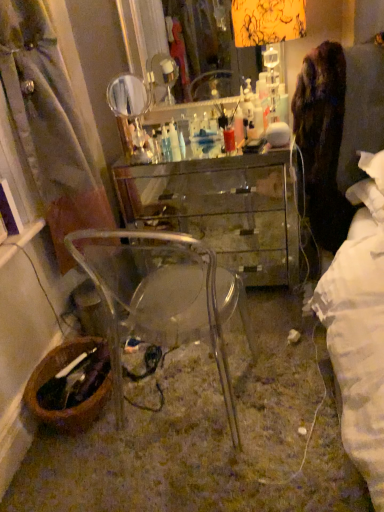
Question: Can you confirm if brown woven picnic basket at lower left is wider than transparent glass desk at center?

Choices:
 (A) yes
 (B) no

Answer: (B)

Question: Is brown woven picnic basket at lower left taller than transparent glass desk at center?

Choices:
 (A) no
 (B) yes

Answer: (A)

Question: Does brown woven picnic basket at lower left have a larger size compared to transparent glass desk at center?

Choices:
 (A) yes
 (B) no

Answer: (B)

Question: From the image's perspective, is brown woven picnic basket at lower left below transparent glass desk at center?

Choices:
 (A) yes
 (B) no

Answer: (A)

Question: Considering the relative positions of brown woven picnic basket at lower left and transparent glass desk at center in the image provided, is brown woven picnic basket at lower left in front of transparent glass desk at center?

Choices:
 (A) yes
 (B) no

Answer: (A)

Question: Would you say transparent glass desk at center is part of brown woven picnic basket at lower left's contents?

Choices:
 (A) yes
 (B) no

Answer: (B)

Question: Does transparent glass desk at center appear on the right side of transparent plastic chair at lower center?

Choices:
 (A) no
 (B) yes

Answer: (B)

Question: Is transparent glass desk at center facing towards transparent plastic chair at lower center?

Choices:
 (A) no
 (B) yes

Answer: (B)

Question: From a real-world perspective, is transparent glass desk at center located beneath transparent plastic chair at lower center?

Choices:
 (A) no
 (B) yes

Answer: (B)

Question: Is transparent plastic chair at lower center at the back of transparent glass desk at center?

Choices:
 (A) yes
 (B) no

Answer: (B)

Question: Considering the relative positions of transparent glass desk at center and transparent plastic chair at lower center in the image provided, is transparent glass desk at center in front of transparent plastic chair at lower center?

Choices:
 (A) no
 (B) yes

Answer: (A)

Question: Is transparent glass desk at center shorter than transparent plastic chair at lower center?

Choices:
 (A) yes
 (B) no

Answer: (A)

Question: Considering the relative sizes of transparent plastic chair at lower center and transparent glass desk at center in the image provided, is transparent plastic chair at lower center wider than transparent glass desk at center?

Choices:
 (A) no
 (B) yes

Answer: (B)